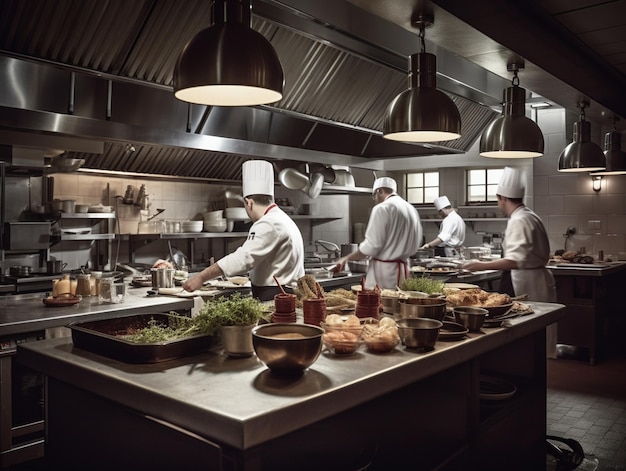
Where is `brick wall`? brick wall is located at coordinates (573, 204).